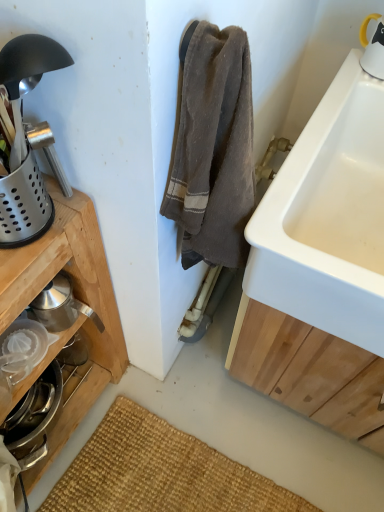
Question: Considering their positions, is stainless steel juicer at lower left located in front of or behind white ceramic sink at right?

Choices:
 (A) behind
 (B) front

Answer: (A)

Question: From a real-world perspective, is stainless steel juicer at lower left positioned above or below white ceramic sink at right?

Choices:
 (A) above
 (B) below

Answer: (B)

Question: Does point (18, 423) appear closer or farther from the camera than point (299, 224)?

Choices:
 (A) farther
 (B) closer

Answer: (A)

Question: From a real-world perspective, is white ceramic sink at right positioned above or below stainless steel juicer at lower left?

Choices:
 (A) below
 (B) above

Answer: (B)

Question: In terms of height, does white ceramic sink at right look taller or shorter compared to stainless steel juicer at lower left?

Choices:
 (A) short
 (B) tall

Answer: (B)

Question: In the image, is white ceramic sink at right positioned in front of or behind stainless steel juicer at lower left?

Choices:
 (A) front
 (B) behind

Answer: (A)

Question: Visually, is white ceramic sink at right positioned to the left or to the right of stainless steel juicer at lower left?

Choices:
 (A) left
 (B) right

Answer: (B)